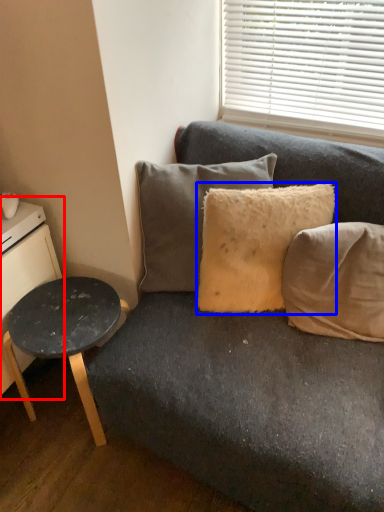
Question: Which object is closer to the camera taking this photo, dresser (highlighted by a red box) or pillow (highlighted by a blue box)?

Choices:
 (A) dresser
 (B) pillow

Answer: (A)